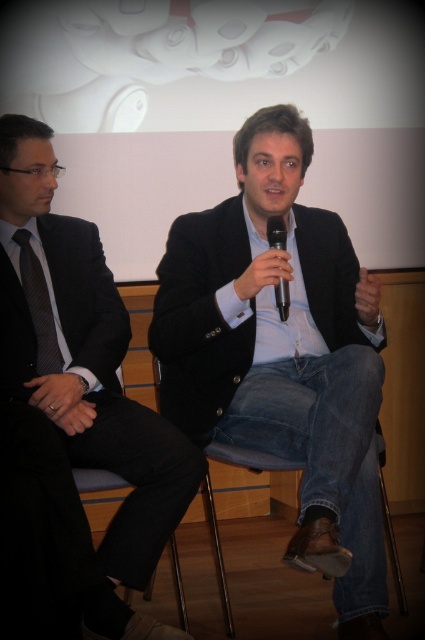
Question: From the image, what is the correct spatial relationship of dark gray textured tie at left in relation to black plastic microphone at center?

Choices:
 (A) below
 (B) above

Answer: (A)

Question: Which is farther from the black plastic microphone at center?

Choices:
 (A) black matte suit at center
 (B) matte black suit at center

Answer: (B)

Question: Is dark gray textured tie at left thinner than black plastic microphone at center?

Choices:
 (A) yes
 (B) no

Answer: (B)

Question: Among these objects, which one is farthest from the camera?

Choices:
 (A) black plastic microphone at center
 (B) black matte suit at center
 (C) matte black suit at center
 (D) dark gray textured tie at left

Answer: (D)

Question: Does black matte suit at center have a greater width compared to matte black suit at center?

Choices:
 (A) yes
 (B) no

Answer: (A)

Question: Which point is farther to the camera?

Choices:
 (A) black plastic microphone at center
 (B) black matte suit at center

Answer: (A)